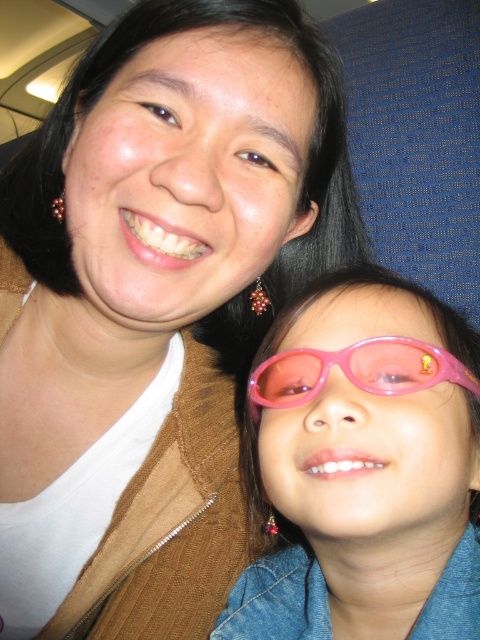
Question: Which of the following is the closest to the observer?

Choices:
 (A) (276, 369)
 (B) (440, 403)

Answer: (B)

Question: Does pink plastic sunglasses at lower right have a greater width compared to pink translucent goggles at lower center?

Choices:
 (A) no
 (B) yes

Answer: (B)

Question: Observing the image, what is the correct spatial positioning of pink plastic sunglasses at lower right in reference to pink translucent goggles at lower center?

Choices:
 (A) above
 (B) below

Answer: (B)

Question: Which of the following is the farthest from the observer?

Choices:
 (A) pink translucent goggles at lower center
 (B) pink plastic sunglasses at lower right

Answer: (A)

Question: Which point is closer to the camera taking this photo?

Choices:
 (A) (446, 358)
 (B) (477, 433)

Answer: (A)

Question: Does pink plastic sunglasses at lower right come in front of pink translucent goggles at lower center?

Choices:
 (A) yes
 (B) no

Answer: (A)